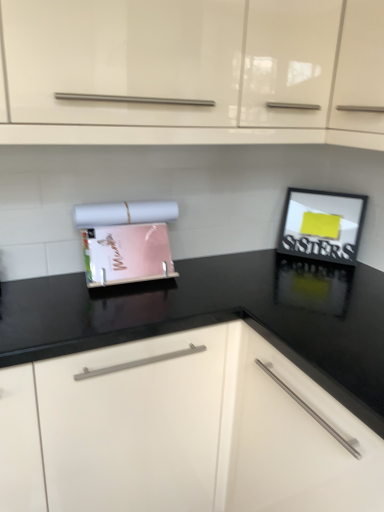
Describe the element at coordinates (181, 431) in the screenshot. I see `black glossy countertop at center, placed as the 2th cabinetry when sorted from top to bottom` at that location.

This screenshot has width=384, height=512. I want to click on black matte picture frame at upper right, so click(322, 225).

This screenshot has width=384, height=512. Describe the element at coordinates (322, 225) in the screenshot. I see `black matte picture frame at upper right` at that location.

What do you see at coordinates (193, 71) in the screenshot?
I see `glossy white cabinet at upper center, which appears as the 1th cabinetry when viewed from the top` at bounding box center [193, 71].

Image resolution: width=384 pixels, height=512 pixels. In order to click on black glossy countertop at center, the first cabinetry in the bottom-to-top sequence in this screenshot , I will do `click(181, 431)`.

Which of these two, black matte picture frame at upper right or glossy white cabinet at upper center, the second cabinetry in the bottom-to-top sequence, stands taller?

Standing taller between the two is glossy white cabinet at upper center, the second cabinetry in the bottom-to-top sequence.

Can you confirm if black matte picture frame at upper right is positioned to the right of glossy white cabinet at upper center, which appears as the 1th cabinetry when viewed from the top?

Yes, black matte picture frame at upper right is to the right of glossy white cabinet at upper center, which appears as the 1th cabinetry when viewed from the top.

What's the angular difference between black matte picture frame at upper right and glossy white cabinet at upper center, the second cabinetry in the bottom-to-top sequence,'s facing directions?

The angular difference between black matte picture frame at upper right and glossy white cabinet at upper center, the second cabinetry in the bottom-to-top sequence, is 49.3 degrees.

Is black matte picture frame at upper right inside or outside of glossy white cabinet at upper center, the second cabinetry in the bottom-to-top sequence?

black matte picture frame at upper right is not enclosed by glossy white cabinet at upper center, the second cabinetry in the bottom-to-top sequence.

Does black glossy countertop at center, placed as the 2th cabinetry when sorted from top to bottom, touch matte plastic magazine holder at center?

No, black glossy countertop at center, placed as the 2th cabinetry when sorted from top to bottom, is not next to matte plastic magazine holder at center.

Is black glossy countertop at center, the first cabinetry in the bottom-to-top sequence, thinner than matte plastic magazine holder at center?

In fact, black glossy countertop at center, the first cabinetry in the bottom-to-top sequence, might be wider than matte plastic magazine holder at center.

Considering the points (40, 383) and (121, 241), which point is behind, point (40, 383) or point (121, 241)?

The point (121, 241) is behind.

How different are the orientations of matte plastic magazine holder at center and glossy white cabinet at upper center, the second cabinetry in the bottom-to-top sequence, in degrees?

The facing directions of matte plastic magazine holder at center and glossy white cabinet at upper center, the second cabinetry in the bottom-to-top sequence, are 3.91 degrees apart.

From the image's perspective, is matte plastic magazine holder at center located above or below glossy white cabinet at upper center, the second cabinetry in the bottom-to-top sequence?

matte plastic magazine holder at center is below glossy white cabinet at upper center, the second cabinetry in the bottom-to-top sequence.

Between matte plastic magazine holder at center and glossy white cabinet at upper center, the second cabinetry in the bottom-to-top sequence, which one has smaller width?

matte plastic magazine holder at center.

In the scene shown: From a real-world perspective, which object stands above the other?

From a 3D spatial view, glossy white cabinet at upper center, the second cabinetry in the bottom-to-top sequence, is above.

Is glossy white cabinet at upper center, which appears as the 1th cabinetry when viewed from the top, far from black glossy countertop at center, the first cabinetry in the bottom-to-top sequence?

glossy white cabinet at upper center, which appears as the 1th cabinetry when viewed from the top, is near black glossy countertop at center, the first cabinetry in the bottom-to-top sequence, not far away.

Is glossy white cabinet at upper center, the second cabinetry in the bottom-to-top sequence, bigger or smaller than black glossy countertop at center, placed as the 2th cabinetry when sorted from top to bottom?

Considering their sizes, glossy white cabinet at upper center, the second cabinetry in the bottom-to-top sequence, takes up less space than black glossy countertop at center, placed as the 2th cabinetry when sorted from top to bottom.

Which is farther from the camera, (61, 25) or (235, 447)?

The point (235, 447) is more distant.

Considering the sizes of glossy white cabinet at upper center, the second cabinetry in the bottom-to-top sequence, and black glossy countertop at center, the first cabinetry in the bottom-to-top sequence, in the image, is glossy white cabinet at upper center, the second cabinetry in the bottom-to-top sequence, wider or thinner than black glossy countertop at center, the first cabinetry in the bottom-to-top sequence,?

Considering their sizes, glossy white cabinet at upper center, the second cabinetry in the bottom-to-top sequence, looks slimmer than black glossy countertop at center, the first cabinetry in the bottom-to-top sequence.

Based on the photo, from a real-world perspective, is glossy white cabinet at upper center, the second cabinetry in the bottom-to-top sequence, positioned over matte plastic magazine holder at center based on gravity?

Yes.

Can you confirm if glossy white cabinet at upper center, which appears as the 1th cabinetry when viewed from the top, is taller than matte plastic magazine holder at center?

Correct, glossy white cabinet at upper center, which appears as the 1th cabinetry when viewed from the top, is much taller as matte plastic magazine holder at center.

Can you see glossy white cabinet at upper center, the second cabinetry in the bottom-to-top sequence, touching matte plastic magazine holder at center?

No, glossy white cabinet at upper center, the second cabinetry in the bottom-to-top sequence, is not with matte plastic magazine holder at center.

Consider the image. From a real-world perspective, which is physically above, black glossy countertop at center, the first cabinetry in the bottom-to-top sequence, or glossy white cabinet at upper center, the second cabinetry in the bottom-to-top sequence?

In real-world perspective, glossy white cabinet at upper center, the second cabinetry in the bottom-to-top sequence, is above.

Is black glossy countertop at center, the first cabinetry in the bottom-to-top sequence, facing away from glossy white cabinet at upper center, the second cabinetry in the bottom-to-top sequence?

No, black glossy countertop at center, the first cabinetry in the bottom-to-top sequence, is not facing the opposite direction of glossy white cabinet at upper center, the second cabinetry in the bottom-to-top sequence.

Based on the photo, considering the sizes of objects black glossy countertop at center, the first cabinetry in the bottom-to-top sequence, and glossy white cabinet at upper center, the second cabinetry in the bottom-to-top sequence, in the image provided, who is bigger, black glossy countertop at center, the first cabinetry in the bottom-to-top sequence, or glossy white cabinet at upper center, the second cabinetry in the bottom-to-top sequence,?

black glossy countertop at center, the first cabinetry in the bottom-to-top sequence, is bigger.

Is black glossy countertop at center, the first cabinetry in the bottom-to-top sequence, at the right side of glossy white cabinet at upper center, which appears as the 1th cabinetry when viewed from the top?

No.

From a real-world perspective, which object rests below the other?

From a 3D spatial view, black glossy countertop at center, placed as the 2th cabinetry when sorted from top to bottom, is below.

The width and height of the screenshot is (384, 512). I want to click on picture frame behind the black glossy countertop at center, the first cabinetry in the bottom-to-top sequence, so click(322, 225).

Between black matte picture frame at upper right and black glossy countertop at center, the first cabinetry in the bottom-to-top sequence, which one has larger size?

black glossy countertop at center, the first cabinetry in the bottom-to-top sequence, is bigger.

Is the position of black matte picture frame at upper right less distant than that of black glossy countertop at center, the first cabinetry in the bottom-to-top sequence?

No, it is behind black glossy countertop at center, the first cabinetry in the bottom-to-top sequence.

Locate an element on the screen. cabinetry located above the black matte picture frame at upper right (from a real-world perspective) is located at coordinates (193, 71).

At what (x,y) coordinates should I click in order to perform the action: click on appliance that appears above the black glossy countertop at center, placed as the 2th cabinetry when sorted from top to bottom (from the image's perspective). Please return your answer as a coordinate pair (x, y). This screenshot has width=384, height=512. Looking at the image, I should click on (126, 241).

Based on their spatial positions, is glossy white cabinet at upper center, the second cabinetry in the bottom-to-top sequence, or black glossy countertop at center, the first cabinetry in the bottom-to-top sequence, closer to matte plastic magazine holder at center?

black glossy countertop at center, the first cabinetry in the bottom-to-top sequence, is positioned closer to the anchor matte plastic magazine holder at center.

When comparing their distances from glossy white cabinet at upper center, the second cabinetry in the bottom-to-top sequence, does matte plastic magazine holder at center or black glossy countertop at center, placed as the 2th cabinetry when sorted from top to bottom, seem closer?

matte plastic magazine holder at center is closer to glossy white cabinet at upper center, the second cabinetry in the bottom-to-top sequence.

Which object lies further to the anchor point glossy white cabinet at upper center, the second cabinetry in the bottom-to-top sequence, black glossy countertop at center, placed as the 2th cabinetry when sorted from top to bottom, or matte plastic magazine holder at center?

black glossy countertop at center, placed as the 2th cabinetry when sorted from top to bottom, lies further to glossy white cabinet at upper center, the second cabinetry in the bottom-to-top sequence, than the other object.

Looking at the image, which one is located closer to glossy white cabinet at upper center, the second cabinetry in the bottom-to-top sequence, black matte picture frame at upper right or matte plastic magazine holder at center?

Among the two, matte plastic magazine holder at center is located nearer to glossy white cabinet at upper center, the second cabinetry in the bottom-to-top sequence.

From the image, which object appears to be farther from black matte picture frame at upper right, black glossy countertop at center, the first cabinetry in the bottom-to-top sequence, or matte plastic magazine holder at center?

black glossy countertop at center, the first cabinetry in the bottom-to-top sequence, is further to black matte picture frame at upper right.

Considering their positions, is black matte picture frame at upper right positioned further to glossy white cabinet at upper center, which appears as the 1th cabinetry when viewed from the top, than black glossy countertop at center, placed as the 2th cabinetry when sorted from top to bottom?

black glossy countertop at center, placed as the 2th cabinetry when sorted from top to bottom, is further to glossy white cabinet at upper center, which appears as the 1th cabinetry when viewed from the top.

When comparing their distances from black matte picture frame at upper right, does matte plastic magazine holder at center or glossy white cabinet at upper center, the second cabinetry in the bottom-to-top sequence, seem closer?

matte plastic magazine holder at center is closer to black matte picture frame at upper right.

Looking at the image, which one is located further to black glossy countertop at center, placed as the 2th cabinetry when sorted from top to bottom, glossy white cabinet at upper center, which appears as the 1th cabinetry when viewed from the top, or matte plastic magazine holder at center?

Based on the image, glossy white cabinet at upper center, which appears as the 1th cabinetry when viewed from the top, appears to be further to black glossy countertop at center, placed as the 2th cabinetry when sorted from top to bottom.

Identify the location of picture frame that lies between glossy white cabinet at upper center, which appears as the 1th cabinetry when viewed from the top, and black glossy countertop at center, the first cabinetry in the bottom-to-top sequence, from top to bottom. (322, 225).

In order to click on appliance between glossy white cabinet at upper center, the second cabinetry in the bottom-to-top sequence, and black glossy countertop at center, placed as the 2th cabinetry when sorted from top to bottom, in the vertical direction in this screenshot , I will do `click(126, 241)`.

The width and height of the screenshot is (384, 512). What are the coordinates of `appliance between glossy white cabinet at upper center, which appears as the 1th cabinetry when viewed from the top, and black matte picture frame at upper right in the front-back direction` in the screenshot? It's located at (126, 241).

You are a GUI agent. You are given a task and a screenshot of the screen. Output one action in this format:
    pyautogui.click(x=<x>, y=<y>)
    Task: Click on the appliance that lies between black matte picture frame at upper right and black glossy countertop at center, placed as the 2th cabinetry when sorted from top to bottom, from top to bottom
    This screenshot has height=512, width=384.
    Given the screenshot: What is the action you would take?
    pyautogui.click(x=126, y=241)